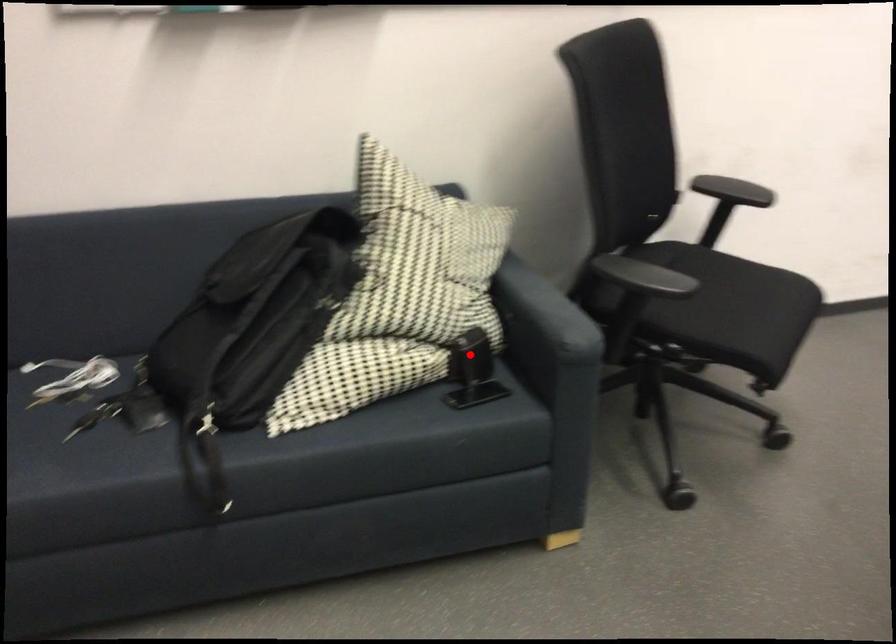
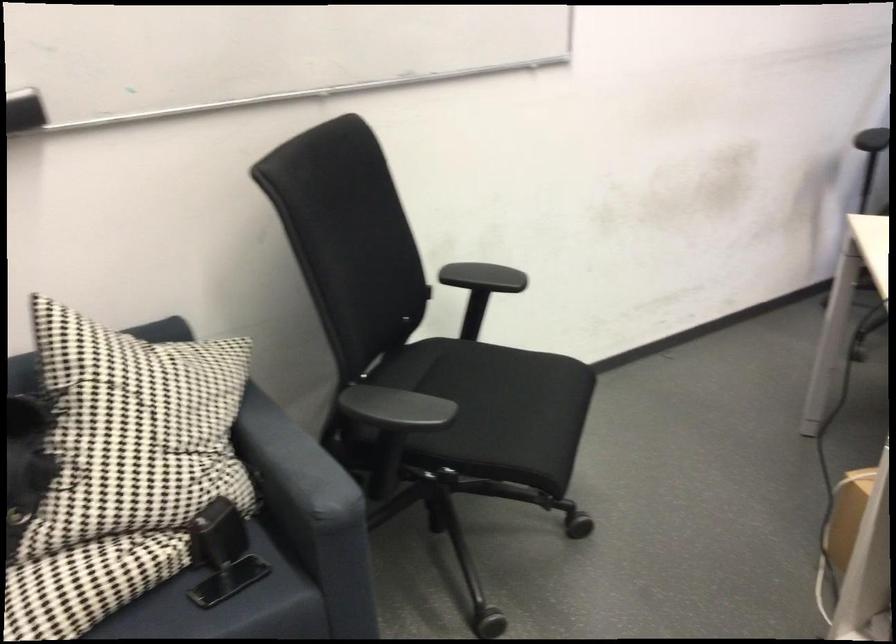
Question: I am providing you with two images of the same scene from different viewpoints. A red point is marked on the first image. Can you still see the location of the red point in image 2?

Choices:
 (A) Yes
 (B) No

Answer: (A)